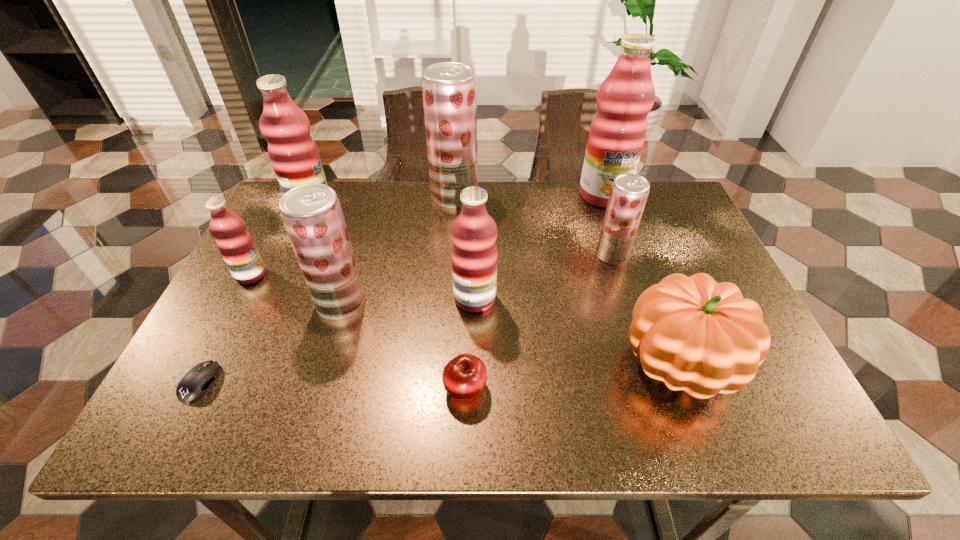
In order to click on blank space that satisfies the following two spatial constraints: 1. on the label of the rightmost strawberry fruit juice; 2. on the right side of the third smallest pink fruit juice in this screenshot , I will do `click(288, 255)`.

The height and width of the screenshot is (540, 960). I want to click on vacant area in the image that satisfies the following two spatial constraints: 1. on the back side of the apple; 2. on the label of the second biggest pink fruit juice, so click(x=470, y=206).

At what (x,y) coordinates should I click in order to perform the action: click on vacant space that satisfies the following two spatial constraints: 1. on the label of the black computer equipment; 2. on the right side of the smallest pink fruit juice. Please return your answer as a coordinate pair (x, y). The height and width of the screenshot is (540, 960). Looking at the image, I should click on (195, 382).